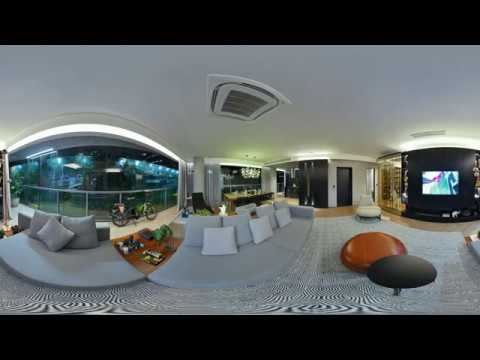
Locate an element on the screen. wall is located at coordinates (330, 184).